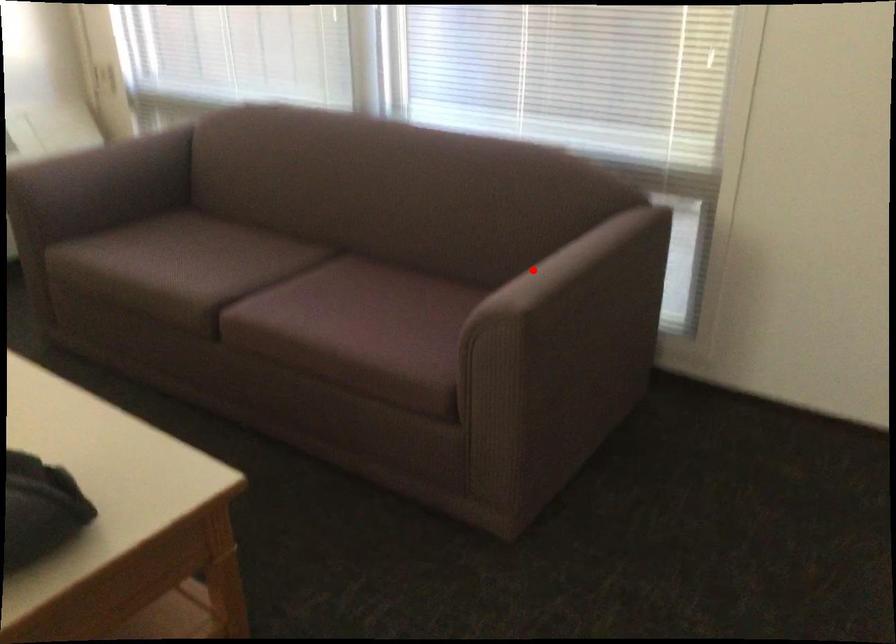
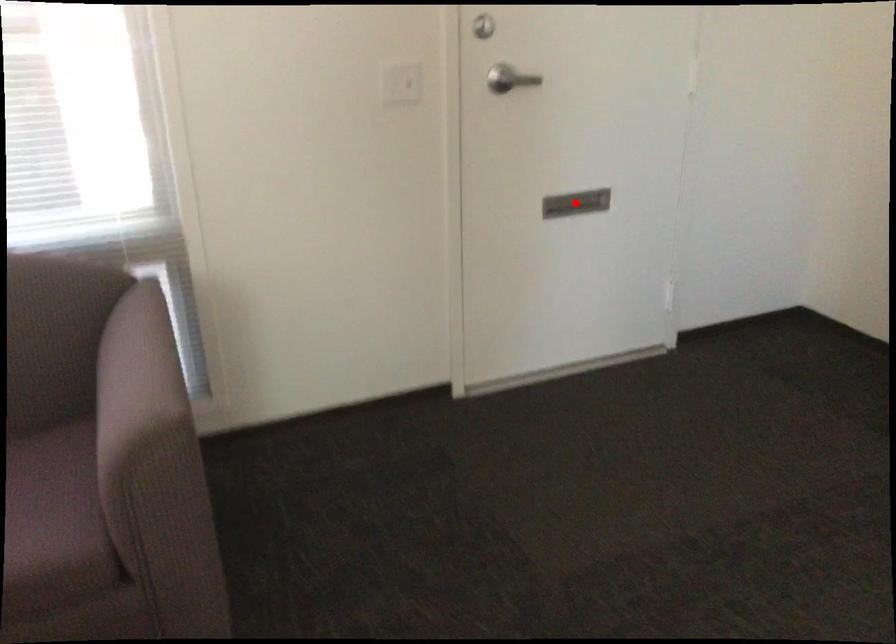
I am providing you with two images of the same scene from different viewpoints. A red point is marked on the first image and another point is marked on the second image. Is the red point in image1 aligned with the point shown in image2?

No